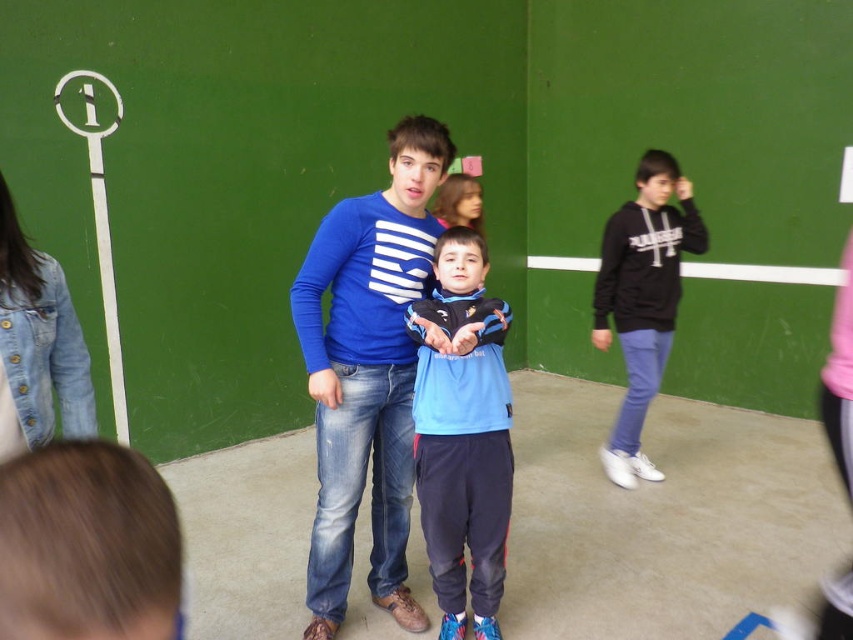
From the picture: Is blue striped long-sleeve shirt at center in front of blue fleece jacket at center?

That is False.

In the scene shown: Which of these two, blue striped long-sleeve shirt at center or blue fleece jacket at center, stands taller?

Standing taller between the two is blue striped long-sleeve shirt at center.

Describe the element at coordinates (367, 372) in the screenshot. This screenshot has width=853, height=640. I see `blue striped long-sleeve shirt at center` at that location.

Identify the location of blue striped long-sleeve shirt at center. The height and width of the screenshot is (640, 853). (367, 372).

Is point (460, 381) positioned behind point (653, 300)?

No, (460, 381) is in front of (653, 300).

Is blue fleece jacket at center smaller than black matte hoodie at right?

Correct, blue fleece jacket at center occupies less space than black matte hoodie at right.

Who is more distant from viewer, (x=448, y=572) or (x=636, y=376)?

The point (x=636, y=376) is behind.

Locate an element on the screen. blue fleece jacket at center is located at coordinates (462, 433).

Which is behind, point (351, 284) or point (672, 156)?

The point (672, 156) is behind.

Can you confirm if blue striped long-sleeve shirt at center is shorter than black matte hoodie at right?

Yes.

Identify the location of blue striped long-sleeve shirt at center. The image size is (853, 640). (367, 372).